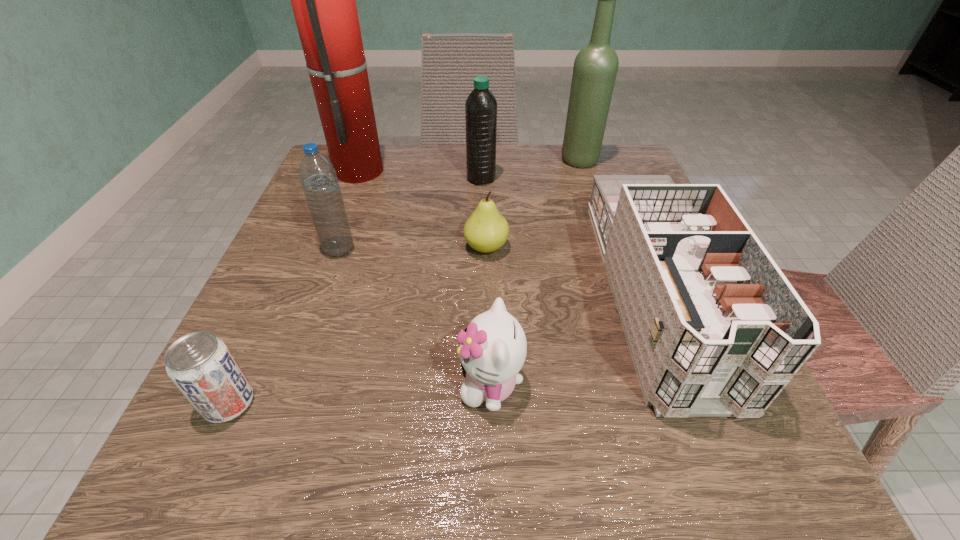
In order to click on vacant area situated on the front of the farther water bottle in this screenshot , I will do `click(481, 211)`.

You are a GUI agent. You are given a task and a screenshot of the screen. Output one action in this format:
    pyautogui.click(x=<x>, y=<y>)
    Task: Click on the free location located 0.330m on the right of the left water bottle
    Image resolution: width=960 pixels, height=540 pixels.
    Given the screenshot: What is the action you would take?
    pyautogui.click(x=535, y=249)

In order to click on vacant space positioned 0.070m at the entrance of the dollhouse in this screenshot , I will do `click(728, 480)`.

At what (x,y) coordinates should I click in order to perform the action: click on free location located on the front-facing side of the kitten. Please return your answer as a coordinate pair (x, y). Image resolution: width=960 pixels, height=540 pixels. Looking at the image, I should click on (400, 384).

I want to click on vacant space situated on the front-facing side of the kitten, so click(342, 384).

Locate an element on the screen. vacant space located on the front-facing side of the kitten is located at coordinates (394, 384).

Find the location of `vacant space located 0.070m on the back of the pear`. vacant space located 0.070m on the back of the pear is located at coordinates (486, 212).

Locate an element on the screen. This screenshot has width=960, height=540. free location located 0.260m on the back of the soda can is located at coordinates (296, 256).

This screenshot has width=960, height=540. I want to click on fire extinguisher positioned at the far edge, so click(x=323, y=0).

This screenshot has width=960, height=540. I want to click on wine bottle that is at the far edge, so click(595, 68).